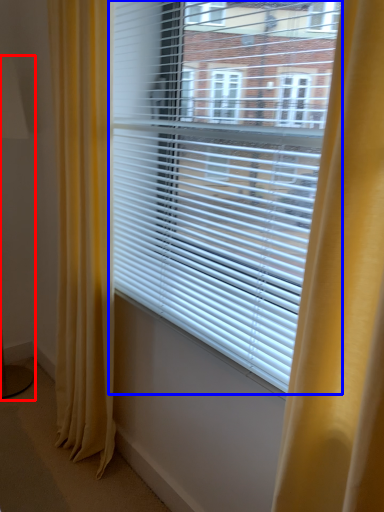
Question: Which object is further to the camera taking this photo, table lamp (highlighted by a red box) or window blind (highlighted by a blue box)?

Choices:
 (A) table lamp
 (B) window blind

Answer: (A)